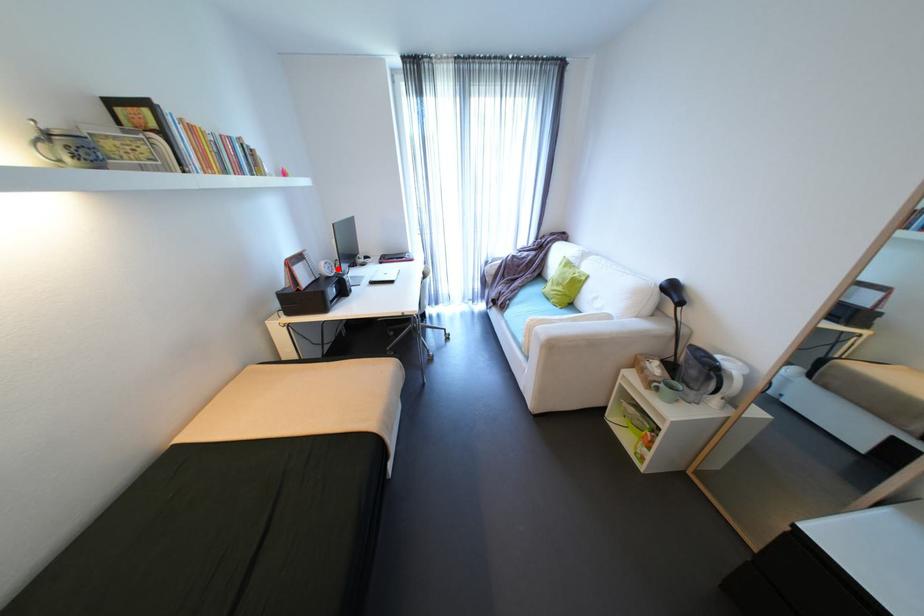
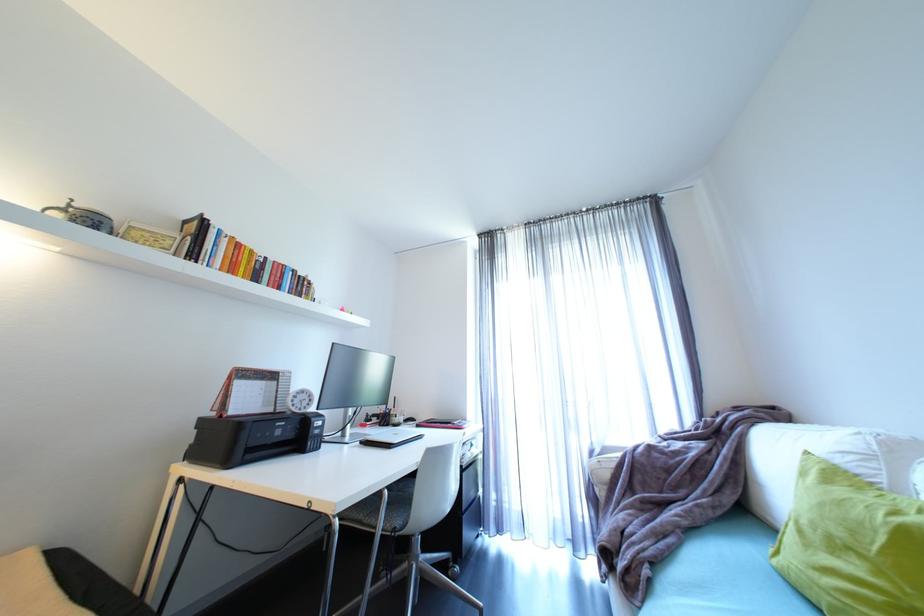
Question: I am providing you with two images of the same scene from different viewpoints. In image1, a red point is highlighted. Considering the same 3D point in image2, which of the following is correct?

Choices:
 (A) It is closer
 (B) It is farther

Answer: (B)